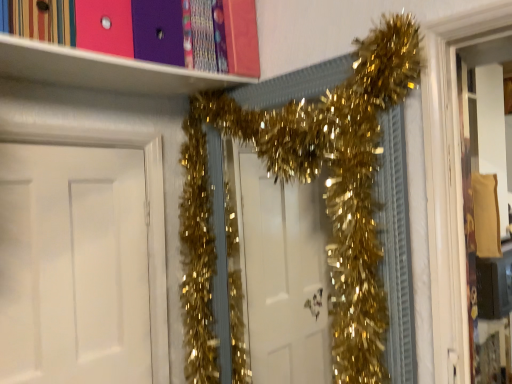
Question: Considering the relative sizes of white matte door at left and gold tinsel garland at center in the image provided, is white matte door at left smaller than gold tinsel garland at center?

Choices:
 (A) no
 (B) yes

Answer: (B)

Question: Is white matte door at left to the left of gold tinsel garland at center from the viewer's perspective?

Choices:
 (A) yes
 (B) no

Answer: (A)

Question: From a real-world perspective, is white matte door at left under gold tinsel garland at center?

Choices:
 (A) yes
 (B) no

Answer: (A)

Question: Is white matte door at left turned away from gold tinsel garland at center?

Choices:
 (A) yes
 (B) no

Answer: (B)

Question: Does white matte door at left have a lesser width compared to gold tinsel garland at center?

Choices:
 (A) no
 (B) yes

Answer: (B)

Question: Is white matte door at left facing towards gold tinsel garland at center?

Choices:
 (A) yes
 (B) no

Answer: (B)

Question: Is gold tinsel garland at center smaller than white matte door at left?

Choices:
 (A) yes
 (B) no

Answer: (B)

Question: Considering the relative sizes of gold tinsel garland at center and white matte door at left in the image provided, is gold tinsel garland at center shorter than white matte door at left?

Choices:
 (A) yes
 (B) no

Answer: (B)

Question: Is gold tinsel garland at center wider than white matte door at left?

Choices:
 (A) no
 (B) yes

Answer: (B)

Question: From a real-world perspective, is gold tinsel garland at center beneath white matte door at left?

Choices:
 (A) no
 (B) yes

Answer: (A)

Question: Considering the relative positions of gold tinsel garland at center and white matte door at left in the image provided, is gold tinsel garland at center to the left of white matte door at left from the viewer's perspective?

Choices:
 (A) yes
 (B) no

Answer: (B)

Question: From the image's perspective, is gold tinsel garland at center on white matte door at left?

Choices:
 (A) no
 (B) yes

Answer: (B)

Question: Looking at the image, does white matte door at left seem bigger or smaller compared to gold tinsel garland at center?

Choices:
 (A) small
 (B) big

Answer: (A)